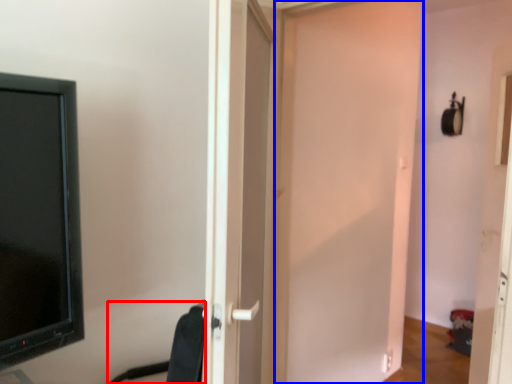
Question: Which object is closer to the camera taking this photo, swivel chair (highlighted by a red box) or door (highlighted by a blue box)?

Choices:
 (A) swivel chair
 (B) door

Answer: (A)